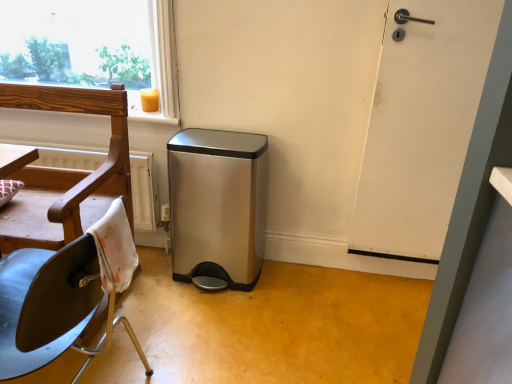
Question: Is point (181, 271) closer or farther from the camera than point (119, 134)?

Choices:
 (A) closer
 (B) farther

Answer: (B)

Question: Is satin steel trash can at center in front of or behind wooden chair at left in the image?

Choices:
 (A) front
 (B) behind

Answer: (B)

Question: Which object is the farthest from the satin steel trash can at center?

Choices:
 (A) white matte door at right
 (B) wooden chair at left

Answer: (A)

Question: Estimate the real-world distances between objects in this image. Which object is closer to the satin steel trash can at center?

Choices:
 (A) wooden chair at left
 (B) white matte door at right

Answer: (A)